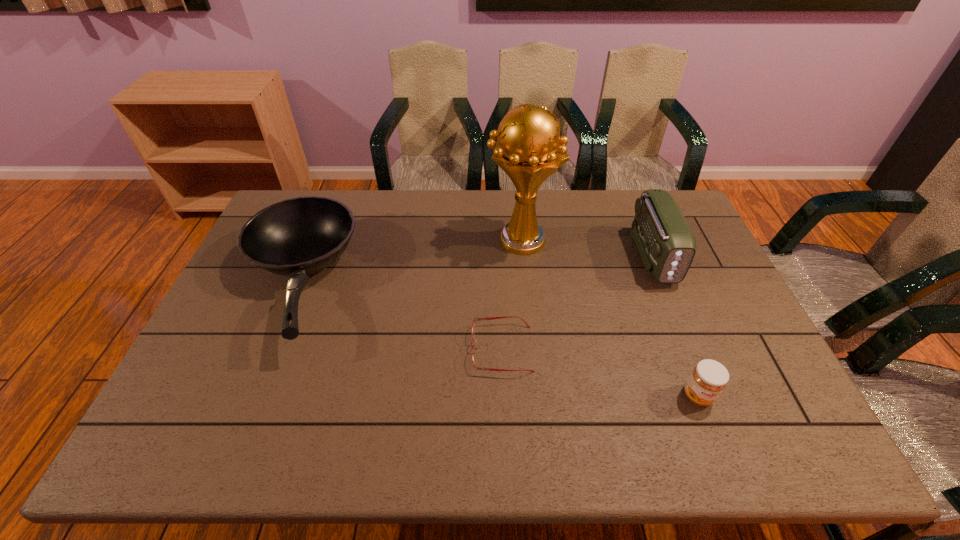
Where is `the tallest object`? The width and height of the screenshot is (960, 540). the tallest object is located at coordinates (529, 149).

You are a GUI agent. You are given a task and a screenshot of the screen. Output one action in this format:
    pyautogui.click(x=<x>, y=<y>)
    Task: Click on the second tallest object
    
    Given the screenshot: What is the action you would take?
    pyautogui.click(x=666, y=243)

Locate an element on the screen. The image size is (960, 540). frying pan is located at coordinates (296, 237).

In order to click on the third tallest object in this screenshot , I will do `click(296, 237)`.

Identify the location of the second shortest object. The image size is (960, 540). [709, 378].

At what (x,y) coordinates should I click in order to perform the action: click on the nearest object. Please return your answer as a coordinate pair (x, y). Looking at the image, I should click on (709, 378).

The image size is (960, 540). I want to click on spectacles, so (x=487, y=318).

At what (x,y) coordinates should I click in order to perform the action: click on vacant area situated 0.360m at the front of the trophy_cup where the globe is prominent. Please return your answer as a coordinate pair (x, y). The width and height of the screenshot is (960, 540). Looking at the image, I should click on (378, 240).

The image size is (960, 540). Identify the location of free space located 0.150m at the front of the trophy_cup where the globe is prominent. (441, 240).

Locate an element on the screen. Image resolution: width=960 pixels, height=540 pixels. vacant region located at the front of the trophy_cup where the globe is prominent is located at coordinates (444, 240).